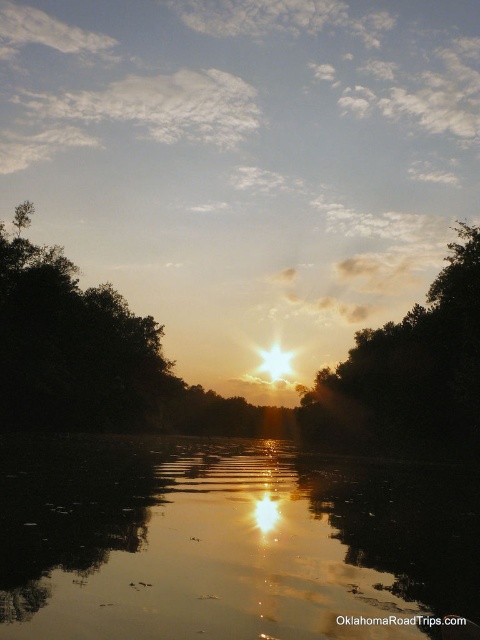
You are standing at the point marked as point (228, 541) in the sunset scene. What do you see directly beneath your feet?

You see glistening reflective water at center directly beneath your feet at point (228, 541).

You are an artist trying to paint the sunset scene. You need to decide which area to focus on first based on their sizes. Which object should you paint first, the glistening reflective water at center or the dark green leafy tree at left?

The glistening reflective water at center is bigger than the dark green leafy tree at left, so you should paint the glistening reflective water at center first as it occupies a larger portion of the scene.

In the scene shown: You are standing at the water edge in the sunset scene. There is a point marked at coordinates point (107,307). Can you reach that point by walking straight ahead without changing direction?

The point (107,307) is 134.45 meters away from viewer. Since it is a straight line distance, you can reach it by walking straight ahead if there are no obstacles. However, the scene description mentions dense trees on both sides of the water, so you might need to navigate around them. The question does not mention any obstacles, so assuming a clear path, yes, you can reach it by walking straight ahead.